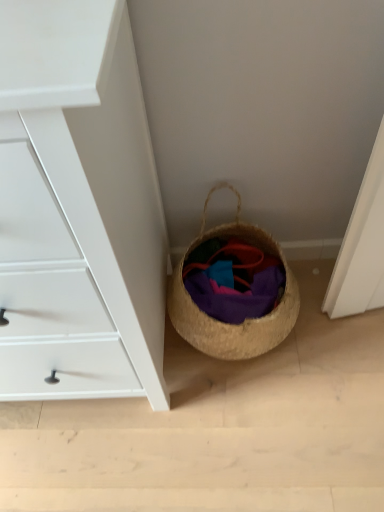
Question: Can you confirm if woven straw basket at lower right is smaller than purple woven fabric at lower center?

Choices:
 (A) yes
 (B) no

Answer: (B)

Question: Is woven straw basket at lower right oriented towards purple woven fabric at lower center?

Choices:
 (A) yes
 (B) no

Answer: (A)

Question: Is woven straw basket at lower right taller than purple woven fabric at lower center?

Choices:
 (A) yes
 (B) no

Answer: (A)

Question: From the image's perspective, would you say woven straw basket at lower right is shown under purple woven fabric at lower center?

Choices:
 (A) yes
 (B) no

Answer: (B)

Question: Is purple woven fabric at lower center located within woven straw basket at lower right?

Choices:
 (A) yes
 (B) no

Answer: (A)

Question: Is point (254, 274) positioned closer to the camera than point (41, 104)?

Choices:
 (A) farther
 (B) closer

Answer: (A)

Question: Considering the positions of purple woven fabric at lower center and white matte chest of drawers at lower left in the image, is purple woven fabric at lower center taller or shorter than white matte chest of drawers at lower left?

Choices:
 (A) short
 (B) tall

Answer: (A)

Question: Considering the positions of purple woven fabric at lower center and white matte chest of drawers at lower left in the image, is purple woven fabric at lower center bigger or smaller than white matte chest of drawers at lower left?

Choices:
 (A) big
 (B) small

Answer: (B)

Question: Is purple woven fabric at lower center spatially inside white matte chest of drawers at lower left, or outside of it?

Choices:
 (A) outside
 (B) inside

Answer: (A)

Question: Relative to purple woven fabric at lower center, is woven straw basket at lower right in front or behind?

Choices:
 (A) behind
 (B) front

Answer: (B)

Question: Looking at the image, does woven straw basket at lower right seem bigger or smaller compared to purple woven fabric at lower center?

Choices:
 (A) big
 (B) small

Answer: (A)

Question: From a real-world perspective, is woven straw basket at lower right above or below purple woven fabric at lower center?

Choices:
 (A) below
 (B) above

Answer: (B)

Question: From their relative heights in the image, would you say woven straw basket at lower right is taller or shorter than purple woven fabric at lower center?

Choices:
 (A) tall
 (B) short

Answer: (A)

Question: From a real-world perspective, is woven straw basket at lower right positioned above or below white matte chest of drawers at lower left?

Choices:
 (A) above
 (B) below

Answer: (B)

Question: Considering the positions of woven straw basket at lower right and white matte chest of drawers at lower left in the image, is woven straw basket at lower right wider or thinner than white matte chest of drawers at lower left?

Choices:
 (A) thin
 (B) wide

Answer: (A)